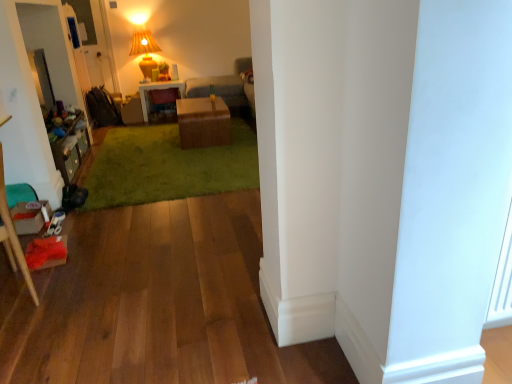
Identify the location of gray fabric couch at center. This screenshot has height=384, width=512. (227, 88).

This screenshot has height=384, width=512. In order to click on wooden stool at left in this screenshot , I will do `click(12, 236)`.

Describe the element at coordinates (70, 146) in the screenshot. I see `wooden dresser at left` at that location.

Find the location of `matte yellow fabric lampshade at upper center`. matte yellow fabric lampshade at upper center is located at coordinates (144, 51).

Where is `gray fabric couch at center`? gray fabric couch at center is located at coordinates (227, 88).

What are the coordinates of `table to the right of green plush carpet at center` in the screenshot? It's located at (203, 122).

Which is closer to the camera, (189, 128) or (210, 179)?

The point (210, 179) is more forward.

Between brown cardboard box at center and green plush carpet at center, which one appears on the right side from the viewer's perspective?

Positioned to the right is brown cardboard box at center.

Are brown cardboard box at center and green plush carpet at center beside each other?

No, brown cardboard box at center is not in contact with green plush carpet at center.

How many degrees apart are the facing directions of gray fabric couch at center and wooden stool at left?

gray fabric couch at center and wooden stool at left are facing 179 degrees away from each other.

Does gray fabric couch at center come behind wooden stool at left?

Yes, the depth of gray fabric couch at center is greater than that of wooden stool at left.

In terms of size, does gray fabric couch at center appear bigger or smaller than wooden stool at left?

In the image, gray fabric couch at center appears to be larger than wooden stool at left.

From a real-world perspective, which is physically below, gray fabric couch at center or wooden stool at left?

wooden stool at left, from a real-world perspective.

There is a wooden stool at left. What are the coordinates of `studio couch above it (from a real-world perspective)` in the screenshot? It's located at (227, 88).

Consider the image. Is gray fabric couch at center at the back of wooden stool at left?

wooden stool at left does not have its back to gray fabric couch at center.

Is wooden stool at left smaller than gray fabric couch at center?

Yes.

From the image's perspective, who appears lower, wooden stool at left or gray fabric couch at center?

wooden stool at left, from the image's perspective.

I want to click on desk below the matte yellow fabric lampshade at upper center (from a real-world perspective), so click(x=158, y=89).

Who is bigger, matte yellow fabric lampshade at upper center or matte brown desk at center?

Bigger between the two is matte brown desk at center.

Is matte yellow fabric lampshade at upper center inside the boundaries of matte brown desk at center, or outside?

matte yellow fabric lampshade at upper center is outside matte brown desk at center.

The image size is (512, 384). Identify the location of grass on the right of matte brown desk at center. (167, 166).

Between green plush carpet at center and matte brown desk at center, which one is positioned in front?

green plush carpet at center is in front.

From the image's perspective, between green plush carpet at center and matte brown desk at center, who is located below?

green plush carpet at center.

Who is smaller, green plush carpet at center or matte brown desk at center?

matte brown desk at center.

I want to click on table below the gray fabric couch at center (from the image's perspective), so [x=203, y=122].

Is gray fabric couch at center turned away from brown cardboard box at center?

gray fabric couch at center is not turned away from brown cardboard box at center.

Between gray fabric couch at center and brown cardboard box at center, which one has more height?

gray fabric couch at center.

From the image's perspective, is gray fabric couch at center located above or below brown cardboard box at center?

Based on their image positions, gray fabric couch at center is located above brown cardboard box at center.

Could you tell me if wooden dresser at left is turned towards brown cardboard box at center?

Yes, wooden dresser at left is facing brown cardboard box at center.

Identify the location of table beneath the wooden dresser at left (from a real-world perspective). This screenshot has height=384, width=512. (203, 122).

In the scene shown: Considering the sizes of wooden dresser at left and brown cardboard box at center in the image, is wooden dresser at left wider or thinner than brown cardboard box at center?

In the image, wooden dresser at left appears to be more narrow than brown cardboard box at center.

Which is in front, wooden dresser at left or brown cardboard box at center?

Positioned in front is wooden dresser at left.

This screenshot has width=512, height=384. Find the location of `grass below the brown cardboard box at center (from the image's perspective)`. grass below the brown cardboard box at center (from the image's perspective) is located at coordinates (x=167, y=166).

Identify the location of studio couch on the right of wooden stool at left. The height and width of the screenshot is (384, 512). (227, 88).

When comparing their distances from wooden dresser at left, does matte brown desk at center or green plush carpet at center seem further?

Among the two, matte brown desk at center is located further to wooden dresser at left.

Based on their spatial positions, is green plush carpet at center or gray fabric couch at center further from matte brown desk at center?

Among the two, green plush carpet at center is located further to matte brown desk at center.

Estimate the real-world distances between objects in this image. Which object is further from matte yellow fabric lampshade at upper center, wooden stool at left or green plush carpet at center?

wooden stool at left lies further to matte yellow fabric lampshade at upper center than the other object.

From the image, which object appears to be farther from wooden dresser at left, green plush carpet at center or wooden stool at left?

The object further to wooden dresser at left is wooden stool at left.

Which object lies further to the anchor point wooden dresser at left, gray fabric couch at center or matte brown desk at center?

matte brown desk at center is further to wooden dresser at left.

Based on their spatial positions, is wooden dresser at left or brown cardboard box at center closer to matte yellow fabric lampshade at upper center?

The object closer to matte yellow fabric lampshade at upper center is brown cardboard box at center.

Based on their spatial positions, is wooden stool at left or matte brown desk at center further from matte yellow fabric lampshade at upper center?

wooden stool at left is positioned further to the anchor matte yellow fabric lampshade at upper center.

Estimate the real-world distances between objects in this image. Which object is further from gray fabric couch at center, brown cardboard box at center or wooden stool at left?

wooden stool at left lies further to gray fabric couch at center than the other object.

Find the location of a particular element. The height and width of the screenshot is (384, 512). table located between wooden stool at left and matte yellow fabric lampshade at upper center in the depth direction is located at coordinates tap(203, 122).

Identify the location of dresser between green plush carpet at center and matte brown desk at center from front to back. This screenshot has width=512, height=384. (70, 146).

Find the location of `dresser between wooden stool at left and brown cardboard box at center in the front-back direction`. dresser between wooden stool at left and brown cardboard box at center in the front-back direction is located at coordinates (70, 146).

Find the location of a particular element. This screenshot has width=512, height=384. lamp positioned between green plush carpet at center and matte brown desk at center from near to far is located at coordinates (144, 51).